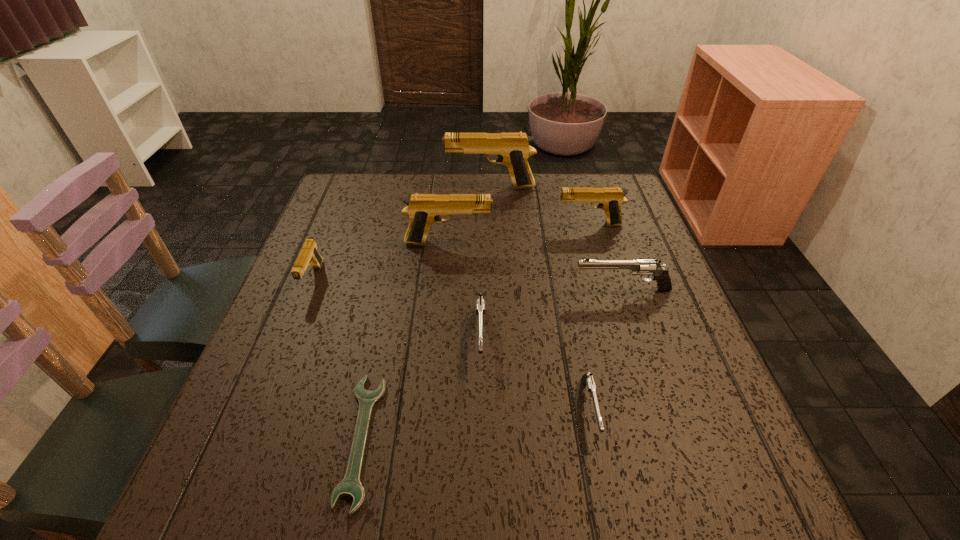
Locate an element on the screen. This screenshot has width=960, height=540. the second nearest silver pistol is located at coordinates (480, 305).

The image size is (960, 540). In order to click on the leftmost silver pistol in this screenshot , I will do `click(480, 305)`.

What are the coordinates of `the nearest silver pistol` in the screenshot? It's located at (587, 379).

You are a GUI agent. You are given a task and a screenshot of the screen. Output one action in this format:
    pyautogui.click(x=<x>, y=<y>)
    Task: Click on the nearest pistol
    The height and width of the screenshot is (540, 960).
    Given the screenshot: What is the action you would take?
    pyautogui.click(x=587, y=379)

Where is `wrench`? The width and height of the screenshot is (960, 540). wrench is located at coordinates (350, 486).

Identify the location of free spot located at the barrel of the farthest pistol. (413, 187).

Where is `vacant space located 0.060m at the barrel of the farthest pistol`? Image resolution: width=960 pixels, height=540 pixels. vacant space located 0.060m at the barrel of the farthest pistol is located at coordinates (426, 187).

The width and height of the screenshot is (960, 540). Find the location of `blank space located 0.270m at the barrel of the farthest pistol`. blank space located 0.270m at the barrel of the farthest pistol is located at coordinates (357, 187).

This screenshot has width=960, height=540. What are the coordinates of `free space located 0.160m at the barrel of the seventh shortest object` in the screenshot? It's located at (554, 242).

I want to click on blank space located 0.280m at the barrel of the third tallest pistol, so click(x=453, y=225).